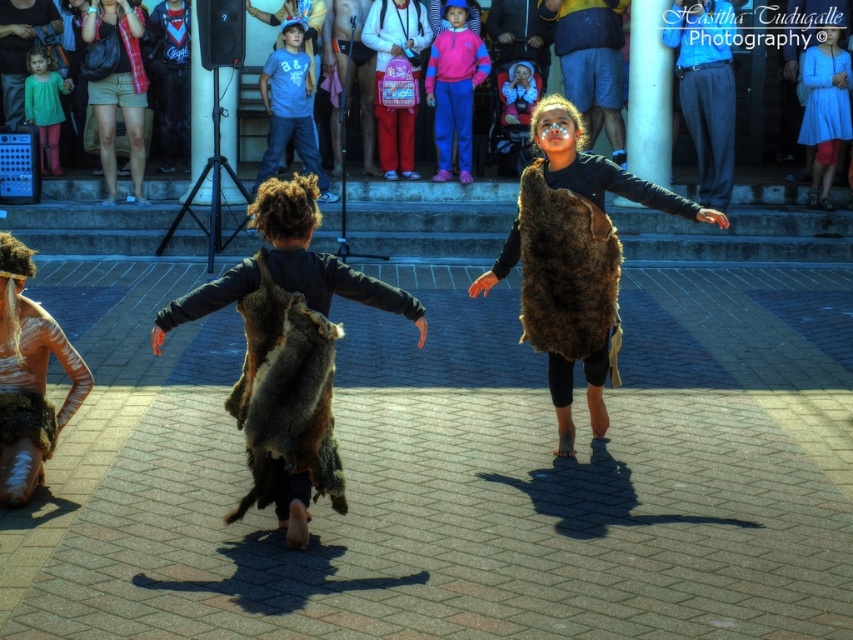
Question: Can you confirm if brown fur coat at center is positioned to the left of matte black clothing at upper center?

Choices:
 (A) yes
 (B) no

Answer: (A)

Question: Which of the following is the closest to the observer?

Choices:
 (A) (817, 115)
 (B) (485, 61)
 (C) (730, 161)

Answer: (C)

Question: Which point appears closest to the camera in this image?

Choices:
 (A) (820, 65)
 (B) (259, 76)
 (C) (631, 144)

Answer: (C)

Question: Observing the image, what is the correct spatial positioning of matte black clothing at upper center in reference to blue fabric dress at upper right?

Choices:
 (A) below
 (B) above

Answer: (B)

Question: Is blue fabric pants at upper right wider than brown fur coat at center?

Choices:
 (A) yes
 (B) no

Answer: (B)

Question: Which point is farther to the camera?

Choices:
 (A) (468, 154)
 (B) (305, 109)

Answer: (A)